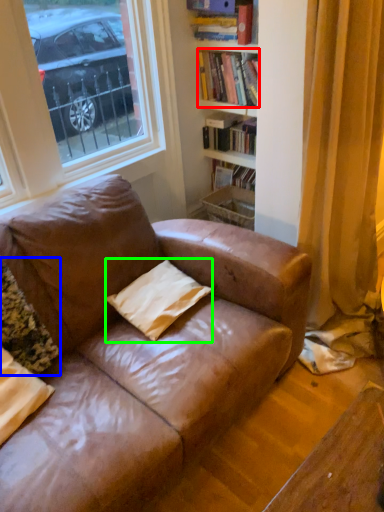
Question: Which object is positioned farthest from book (highlighted by a red box)? Select from pillow (highlighted by a blue box) and pillow (highlighted by a green box).

Choices:
 (A) pillow
 (B) pillow

Answer: (A)